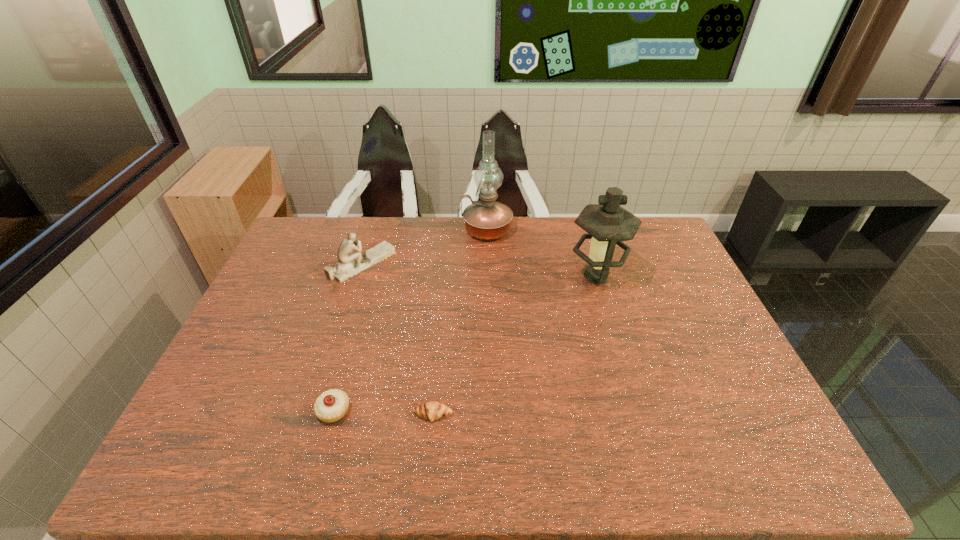
Find the location of a particular element. blank space located on the back of the fourth shortest object is located at coordinates (581, 225).

Identify the location of free space located on the front-facing side of the third tallest object. (451, 264).

Find the location of a particular element. vacant space located 0.340m on the right of the left pastry is located at coordinates (492, 411).

Where is `vacant area situated on the front-facing side of the shorter pastry`? The height and width of the screenshot is (540, 960). vacant area situated on the front-facing side of the shorter pastry is located at coordinates click(x=429, y=456).

At what (x,y) coordinates should I click in order to perform the action: click on oil lamp at the far edge. Please return your answer as a coordinate pair (x, y). Looking at the image, I should click on (486, 219).

Locate an element on the screen. The image size is (960, 540). figurine that is at the far edge is located at coordinates [x=350, y=262].

Image resolution: width=960 pixels, height=540 pixels. I want to click on blank area at the far edge, so click(x=507, y=256).

Where is `free space at the near edge of the desktop`? Image resolution: width=960 pixels, height=540 pixels. free space at the near edge of the desktop is located at coordinates (562, 473).

In the image, there is a desktop. Where is `blank space at the left edge`? The height and width of the screenshot is (540, 960). blank space at the left edge is located at coordinates (300, 309).

The height and width of the screenshot is (540, 960). In the image, there is a desktop. Find the location of `vacant space at the right edge`. vacant space at the right edge is located at coordinates (705, 331).